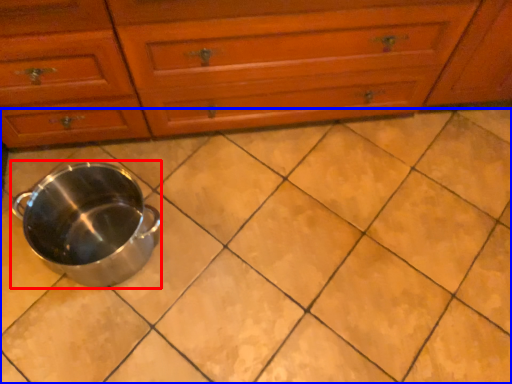
Question: Which object appears farthest to the camera in this image, crock pot (highlighted by a red box) or ceramic tile (highlighted by a blue box)?

Choices:
 (A) crock pot
 (B) ceramic tile

Answer: (B)